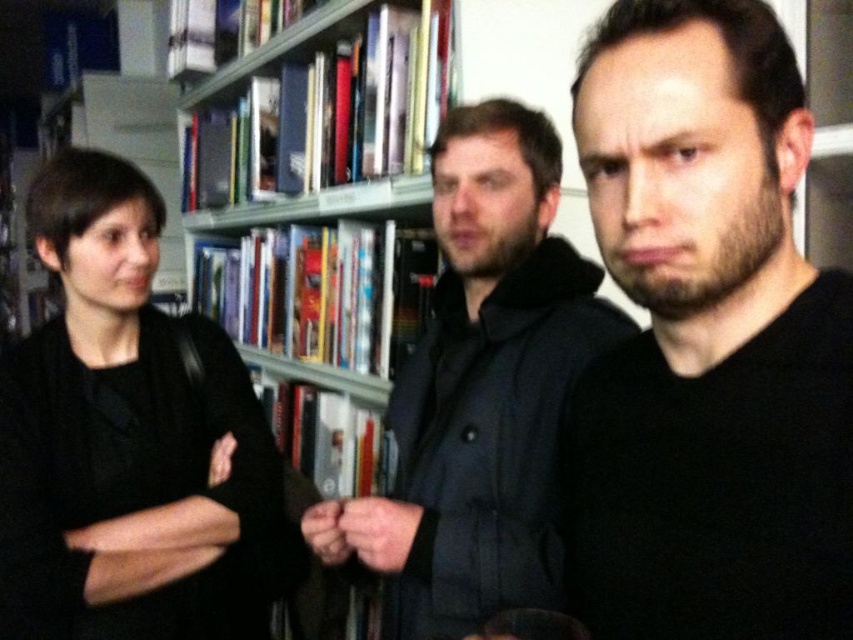
You are a tailor measuring clothing items in a store. You have a rack with two items displayed horizontally. The items are the black matte shirt at center and the black matte jacket at left. Which item is narrower?

The black matte shirt at center is narrower than the black matte jacket at left, so the black matte shirt at center is the narrower item.

You are a store manager checking the layout of the store. You see the black matte shirt at center and the metallic gray bookshelf at upper center. Which object takes up more horizontal space in the image?

The metallic gray bookshelf at upper center takes up more horizontal space than the black matte shirt at center because the black matte shirt at center has a lesser width compared to the metallic gray bookshelf at upper center.